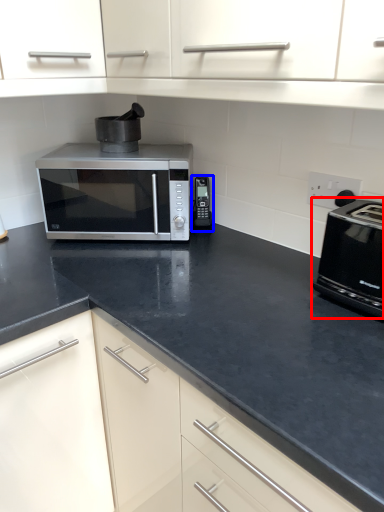
Question: Which object appears closest to the camera in this image, toaster (highlighted by a red box) or appliance (highlighted by a blue box)?

Choices:
 (A) toaster
 (B) appliance

Answer: (A)